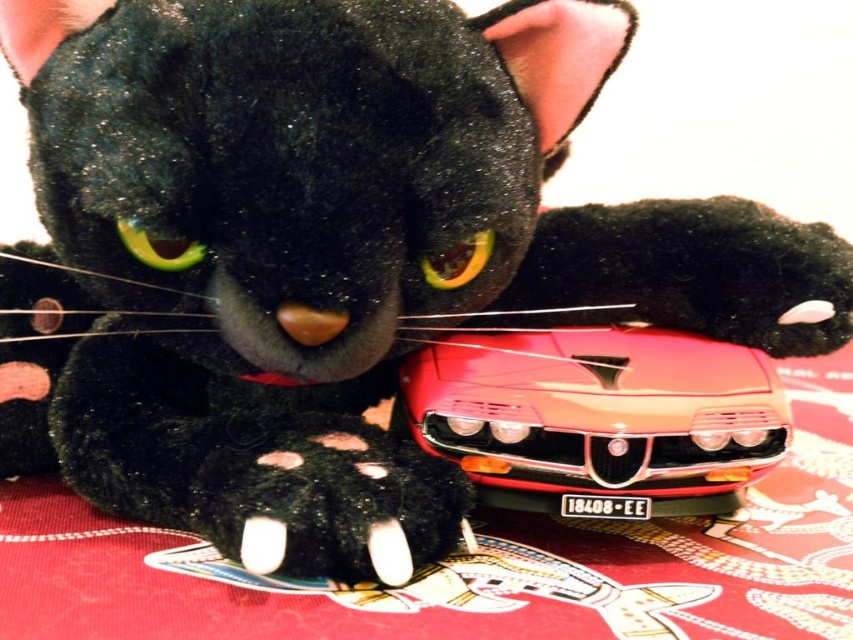
You are a cat owner who wants to place a small bowl on the table where the red fabric tablecloth at center and shiny red plastic toy car at center are. Where should you place the bowl so it doesn t fall off the table?

The red fabric tablecloth at center is located above the shiny red plastic toy car at center, so placing the bowl on the tablecloth area would be safer as it is higher and more stable than the area near the toy car.

You are holding a laser pointer and want to point it at the point marked as point (849, 420). If the laser pointer has a maximum range of 35 inches, will it reach the point?

The point (849, 420) is 36.55 inches away from the viewer, which exceeds the laser pointer maximum range of 35 inches. Therefore, the laser pointer will not reach the point.

You are a cat owner who wants to ensure your cat can reach its toy. Based on the image, is the shiny red plastic toy car at center positioned above or below the black fuzzy paw at lower center?

The shiny red plastic toy car at center is above the black fuzzy paw at lower center, so the cat may need to stretch or jump to reach it.